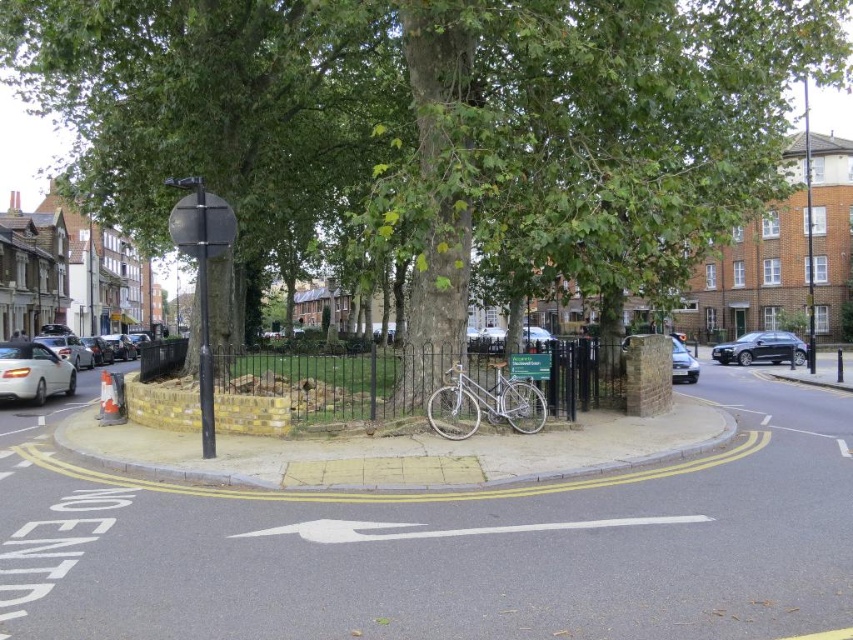
You are a delivery person needing to load a large package onto a cart. You see a silver metallic bicycle at center and a metallic silver car at center. Which object is closer to the left side of the cart so you can move it out of the way first?

The silver metallic bicycle at center is positioned on the left side of the metallic silver car at center, so it is closer to the left side of the cart and should be moved first.